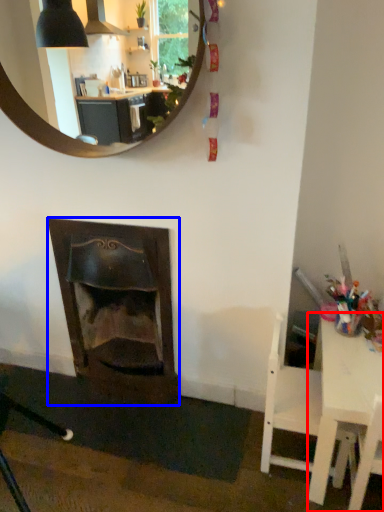
Question: Which object appears farthest to the camera in this image, table (highlighted by a red box) or fireplace (highlighted by a blue box)?

Choices:
 (A) table
 (B) fireplace

Answer: (B)